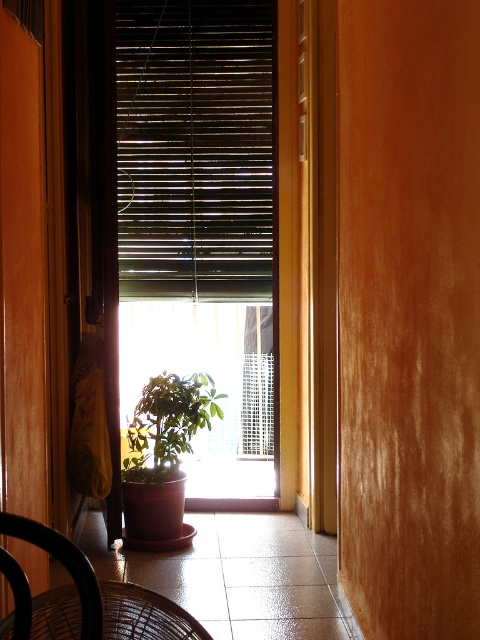
Does wooden blinds at center come in front of black wire chair at lower left?

No, wooden blinds at center is further to the viewer.

Identify the location of wooden blinds at center. Image resolution: width=480 pixels, height=640 pixels. (194, 148).

Which is below, green matte plant at lower center or brown woven chair at lower left?

Positioned lower is green matte plant at lower center.

Is green matte plant at lower center to the right of brown woven chair at lower left from the viewer's perspective?

Indeed, green matte plant at lower center is positioned on the right side of brown woven chair at lower left.

This screenshot has height=640, width=480. Identify the location of green matte plant at lower center. (168, 424).

From the picture: Is wooden blinds at center taller than green matte plant at lower center?

Yes.

What do you see at coordinates (194, 148) in the screenshot? The height and width of the screenshot is (640, 480). I see `wooden blinds at center` at bounding box center [194, 148].

This screenshot has height=640, width=480. Find the location of `wooden blinds at center`. wooden blinds at center is located at coordinates (194, 148).